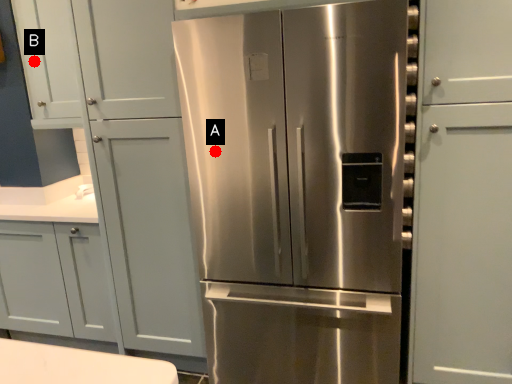
Question: Two points are circled on the image, labeled by A and B beside each circle. Which point is farther to the camera?

Choices:
 (A) A is further
 (B) B is further

Answer: (B)